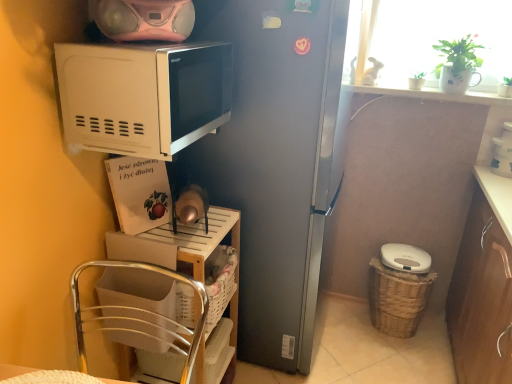
The image size is (512, 384). I want to click on white matte microwave at upper left, so click(x=142, y=96).

What is the approximate height of white plastic shelf at lower left?

It is 30.81 inches.

This screenshot has height=384, width=512. In order to click on metallic silver chair at lower left in this screenshot , I will do `click(142, 315)`.

The height and width of the screenshot is (384, 512). What do you see at coordinates (483, 286) in the screenshot?
I see `brown wood cabinet at lower right` at bounding box center [483, 286].

At what (x,y) coordinates should I click in order to perform the action: click on green matte plant at upper right. Please return your answer as a coordinate pair (x, y). Looking at the image, I should click on (460, 53).

This screenshot has height=384, width=512. In order to click on white matte microwave at upper left in this screenshot , I will do `click(142, 96)`.

From a real-world perspective, who is located higher, white woven table at lower left or metallic silver chair at lower left?

white woven table at lower left.

Looking at this image, would you say white woven table at lower left is inside or outside metallic silver chair at lower left?

white woven table at lower left can be found inside metallic silver chair at lower left.

Considering the sizes of white woven table at lower left and metallic silver chair at lower left in the image, is white woven table at lower left taller or shorter than metallic silver chair at lower left?

Considering their sizes, white woven table at lower left has less height than metallic silver chair at lower left.

You are a GUI agent. You are given a task and a screenshot of the screen. Output one action in this format:
    pyautogui.click(x=<x>, y=<y>)
    Task: Click on the table that is above the metallic silver chair at lower left (from the image's perspective)
    The width and height of the screenshot is (512, 384).
    Given the screenshot: What is the action you would take?
    pyautogui.click(x=13, y=370)

This screenshot has width=512, height=384. Find the location of `table below the white matte microwave at upper left (from a real-world perspective)`. table below the white matte microwave at upper left (from a real-world perspective) is located at coordinates (13, 370).

What's the angular difference between white woven table at lower left and white matte microwave at upper left's facing directions?

The angle between the facing direction of white woven table at lower left and the facing direction of white matte microwave at upper left is 1.65 degrees.

Is white woven table at lower left wider than white matte microwave at upper left?

Yes, white woven table at lower left is wider than white matte microwave at upper left.

Is metallic silver chair at lower left facing towards white plastic shelf at lower left?

No, metallic silver chair at lower left is not oriented towards white plastic shelf at lower left.

In terms of width, does metallic silver chair at lower left look wider or thinner when compared to white plastic shelf at lower left?

Considering their sizes, metallic silver chair at lower left looks broader than white plastic shelf at lower left.

From the image's perspective, which object appears higher, metallic silver chair at lower left or white plastic shelf at lower left?

white plastic shelf at lower left.

The height and width of the screenshot is (384, 512). I want to click on shelf on the right side of metallic silver chair at lower left, so click(x=179, y=243).

Is white woven basket at lower left, which is counted as the third basket, starting from the right, not near white plastic shelf at lower left?

They are positioned close to each other.

From the image's perspective, is white woven basket at lower left, which is counted as the 1th basket, starting from the front, above white plastic shelf at lower left?

Yes, from the image's perspective, white woven basket at lower left, which is counted as the 1th basket, starting from the front, is on top of white plastic shelf at lower left.

Does white woven basket at lower left, which is counted as the 1th basket, starting from the front, have a greater width compared to white plastic shelf at lower left?

No.

Is white woven basket at lower left, which is counted as the third basket, starting from the right, located outside white plastic shelf at lower left?

Yes, white woven basket at lower left, which is counted as the third basket, starting from the right, is outside of white plastic shelf at lower left.

Which object is more forward, satin silver fridge at center or brown wood cabinet at lower right?

brown wood cabinet at lower right.

Considering the relative sizes of satin silver fridge at center and brown wood cabinet at lower right in the image provided, is satin silver fridge at center smaller than brown wood cabinet at lower right?

Incorrect, satin silver fridge at center is not smaller in size than brown wood cabinet at lower right.

Is satin silver fridge at center not near brown wood cabinet at lower right?

No, satin silver fridge at center is not far away from brown wood cabinet at lower right.

From a real-world perspective, who is located lower, white plastic shelf at lower left or brown wood cabinet at lower right?

white plastic shelf at lower left is physically lower.

Is white plastic shelf at lower left located outside brown wood cabinet at lower right?

white plastic shelf at lower left lies outside brown wood cabinet at lower right's area.

Is white plastic shelf at lower left to the left of brown wood cabinet at lower right from the viewer's perspective?

Indeed, white plastic shelf at lower left is positioned on the left side of brown wood cabinet at lower right.

From their relative heights in the image, would you say white plastic shelf at lower left is taller or shorter than brown wood cabinet at lower right?

In the image, white plastic shelf at lower left appears to be shorter than brown wood cabinet at lower right.

Is brown wood cabinet at lower right bigger or smaller than pink matte speaker at upper center, the 1th appliance viewed from the left?

brown wood cabinet at lower right is bigger than pink matte speaker at upper center, the 1th appliance viewed from the left.

Is brown wood cabinet at lower right inside the boundaries of pink matte speaker at upper center, the 1th appliance viewed from the left, or outside?

brown wood cabinet at lower right is outside pink matte speaker at upper center, the 1th appliance viewed from the left.

Which object is further away from the camera taking this photo, brown wood cabinet at lower right or pink matte speaker at upper center, marked as the third appliance in a bottom-to-top arrangement?

Positioned behind is pink matte speaker at upper center, marked as the third appliance in a bottom-to-top arrangement.

Locate an element on the screen. chair lying below the white woven table at lower left (from the image's perspective) is located at coordinates (142, 315).

The width and height of the screenshot is (512, 384). Identify the location of microwave oven above the white woven table at lower left (from a real-world perspective). (142, 96).

Based on their spatial positions, is green matte plant at upper right or white woven table at lower left closer to white matte microwave at upper left?

white woven table at lower left is closer to white matte microwave at upper left.

From the picture: From the image, which object appears to be farther from white plastic shelf at lower left, satin silver fridge at center or metallic silver chair at lower left?

satin silver fridge at center is further to white plastic shelf at lower left.

Considering their positions, is metallic silver chair at lower left positioned closer to green matte plant at upper right than brown wood cabinet at lower right?

Among the two, brown wood cabinet at lower right is located nearer to green matte plant at upper right.

Which object lies further to the anchor point satin silver fridge at center, white matte microwave at upper left or white plastic trash can at lower right, which is the second appliance in right-to-left order?

The object further to satin silver fridge at center is white plastic trash can at lower right, which is the second appliance in right-to-left order.

Looking at the image, which one is located closer to white glossy coffee maker at upper right, arranged as the 1th appliance when viewed from the right, brown wood cabinet at lower right or metallic silver chair at lower left?

brown wood cabinet at lower right lies closer to white glossy coffee maker at upper right, arranged as the 1th appliance when viewed from the right, than the other object.

Looking at the image, which one is located further to white glossy coffee maker at upper right, which appears as the 2th appliance when viewed from the front, white matte microwave at upper left or woven brown basket at lower right, which appears as the first basket when viewed from the right?

The object further to white glossy coffee maker at upper right, which appears as the 2th appliance when viewed from the front, is white matte microwave at upper left.

Looking at the image, which one is located closer to white plastic shelf at lower left, pink matte speaker at upper center, positioned as the 1th appliance in front-to-back order, or white woven basket at lower center, placed as the second basket when sorted from right to left?

white woven basket at lower center, placed as the second basket when sorted from right to left, is positioned closer to the anchor white plastic shelf at lower left.

Which object lies further to the anchor point pink matte speaker at upper center, acting as the 3th appliance starting from the back, white plastic shelf at lower left or metallic silver chair at lower left?

The object further to pink matte speaker at upper center, acting as the 3th appliance starting from the back, is metallic silver chair at lower left.

Where is `microwave oven between white plastic shelf at lower left and brown wood cabinet at lower right in the horizontal direction`? The image size is (512, 384). microwave oven between white plastic shelf at lower left and brown wood cabinet at lower right in the horizontal direction is located at coordinates (142, 96).

The width and height of the screenshot is (512, 384). Identify the location of appliance located between pink matte speaker at upper center, positioned as the 1th appliance in front-to-back order, and brown wood cabinet at lower right in the left-right direction. (405, 258).

Identify the location of fridge between pink matte speaker at upper center, the 3th appliance from the right, and metallic silver chair at lower left vertically. (274, 163).

Locate an element on the screen. fridge between pink matte speaker at upper center, the 3th appliance from the right, and white woven basket at lower center, which appears as the 2th basket when viewed from the back, in the up-down direction is located at coordinates (274, 163).